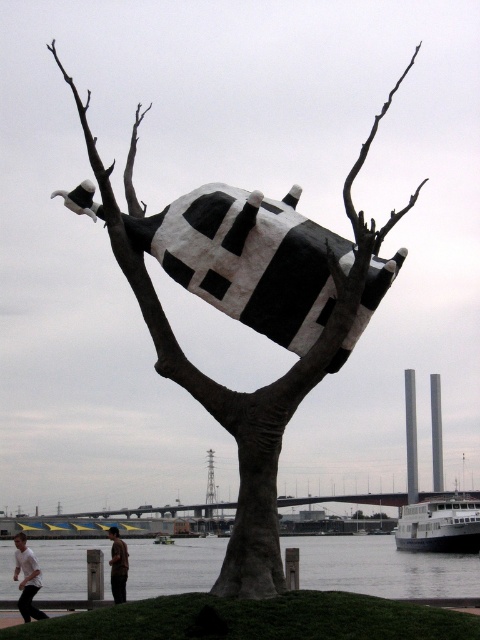
Question: Does black and white painted sculpture at center have a greater width compared to white shirt at lower left?

Choices:
 (A) no
 (B) yes

Answer: (B)

Question: Does black and white painted sculpture at center appear under white shirt at lower left?

Choices:
 (A) yes
 (B) no

Answer: (B)

Question: Among these objects, which one is nearest to the camera?

Choices:
 (A) brown cotton shirt at lower center
 (B) black matte sculpture at center
 (C) transparent water at lower center

Answer: (B)

Question: Considering the relative positions of transparent water at lower center and brown cotton shirt at lower center in the image provided, where is transparent water at lower center located with respect to brown cotton shirt at lower center?

Choices:
 (A) left
 (B) right

Answer: (B)

Question: Which of the following is the closest to the observer?

Choices:
 (A) (365, 298)
 (B) (117, 592)
 (C) (275, 401)
 (D) (285, 540)

Answer: (C)

Question: Which of the following is the closest to the observer?

Choices:
 (A) transparent water at lower center
 (B) black matte sculpture at center
 (C) black and white painted sculpture at center
 (D) brown cotton shirt at lower center

Answer: (B)